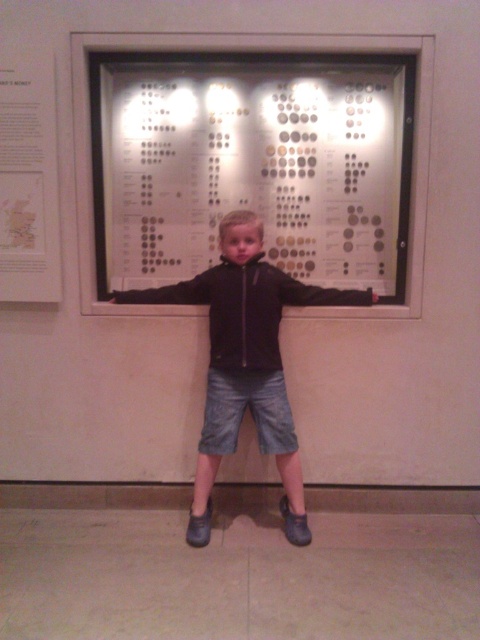
Question: Which of these objects is positioned farthest from the black matte arm at center?

Choices:
 (A) metallic coins at center
 (B) black leather arm at center
 (C) white paper at upper left

Answer: (C)

Question: Is the position of denim shorts at center more distant than that of white paper at upper left?

Choices:
 (A) no
 (B) yes

Answer: (B)

Question: Which point is closer to the camera?

Choices:
 (A) (179, 300)
 (B) (216, 371)

Answer: (B)

Question: Does metallic coins at center come behind white paper at upper left?

Choices:
 (A) no
 (B) yes

Answer: (B)

Question: Which of these objects is positioned closest to the black matte arm at center?

Choices:
 (A) metallic coins at center
 (B) black leather arm at center

Answer: (B)

Question: Is metallic coins at center to the right of white paper at upper left from the viewer's perspective?

Choices:
 (A) no
 (B) yes

Answer: (B)